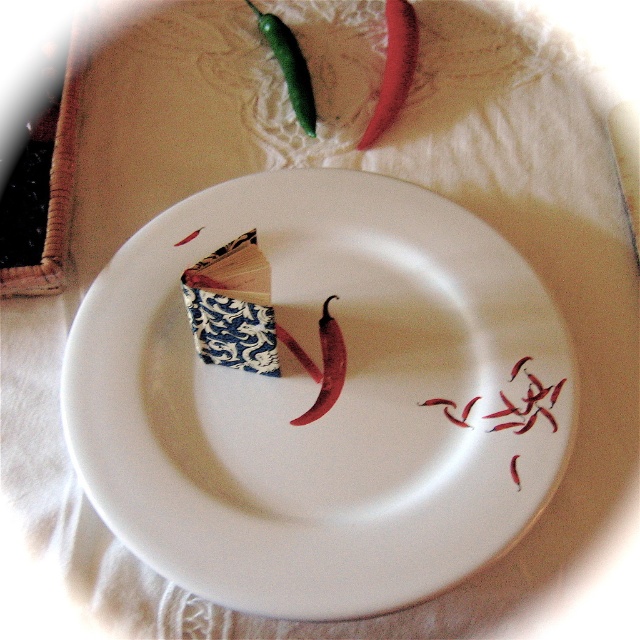
Question: Is white glossy plate at center below smooth red pepper at upper center?

Choices:
 (A) no
 (B) yes

Answer: (B)

Question: Does green glossy pepper at upper center have a larger size compared to smooth red pepper at center?

Choices:
 (A) yes
 (B) no

Answer: (A)

Question: Which point is closer to the camera?

Choices:
 (A) (326, 362)
 (B) (257, 612)

Answer: (B)

Question: Which of the following is the farthest from the observer?

Choices:
 (A) white glossy plate at center
 (B) smooth red pepper at center
 (C) red matte chili peppers at lower right

Answer: (B)

Question: Can you confirm if red matte chili peppers at lower right is smaller than green glossy pepper at upper center?

Choices:
 (A) no
 (B) yes

Answer: (A)

Question: Estimate the real-world distances between objects in this image. Which object is farther from the red matte chili peppers at lower right?

Choices:
 (A) white glossy plate at center
 (B) smooth red pepper at center
 (C) smooth red pepper at upper center
 (D) green glossy pepper at upper center

Answer: (D)